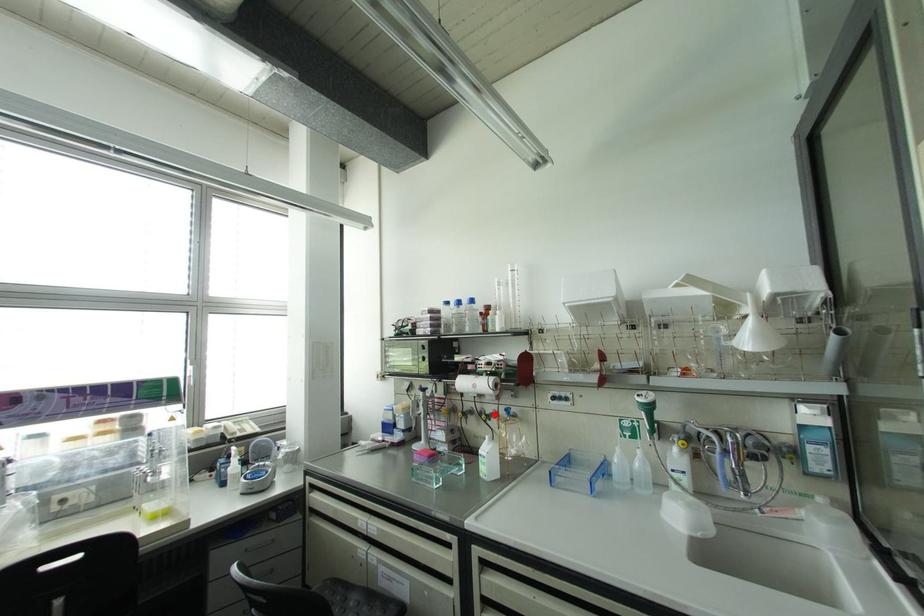
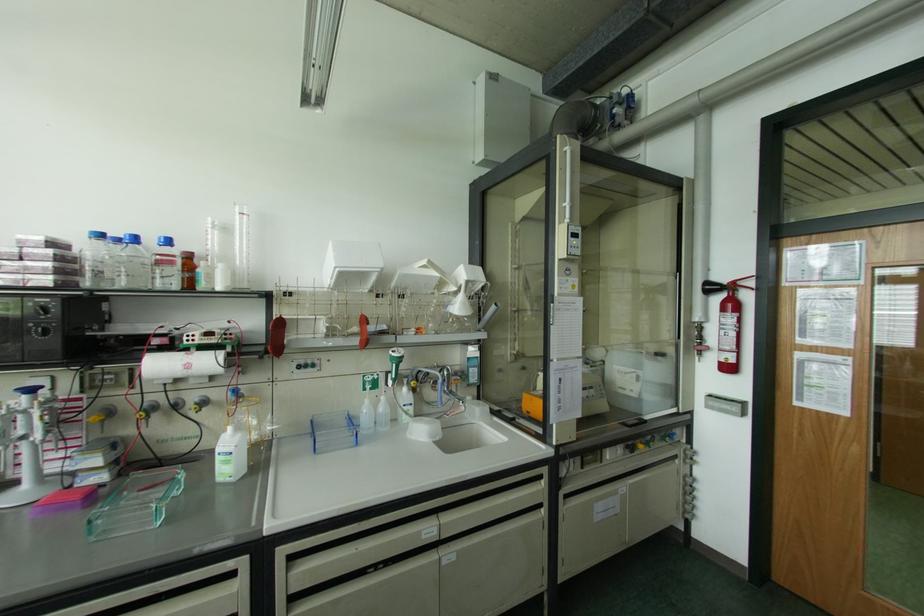
In the second image, find the point that corresponds to the highlighted location in the first image.

(203, 402)